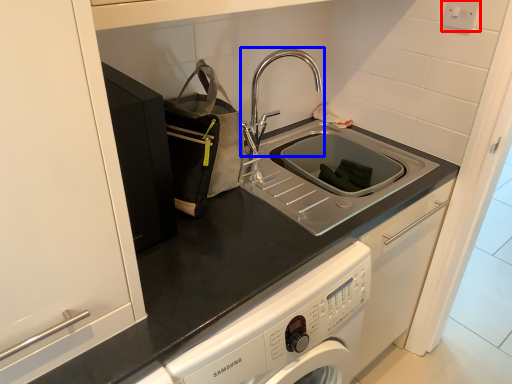
Question: Which point is further to the camera, electric outlet (highlighted by a red box) or tap (highlighted by a blue box)?

Choices:
 (A) electric outlet
 (B) tap

Answer: (A)